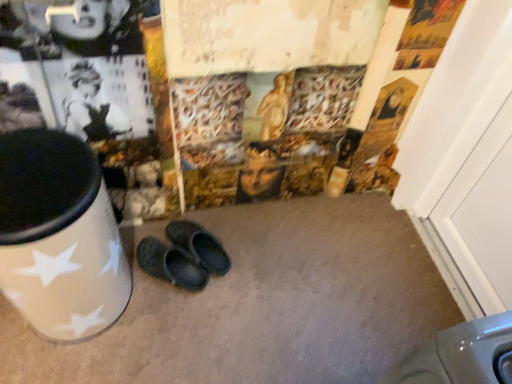
Question: Does white wood door at right have a greater width compared to black rubber clogs at center?

Choices:
 (A) yes
 (B) no

Answer: (B)

Question: Is white wood door at right facing away from black rubber clogs at center?

Choices:
 (A) yes
 (B) no

Answer: (B)

Question: Is white wood door at right completely or partially outside of black rubber clogs at center?

Choices:
 (A) no
 (B) yes

Answer: (B)

Question: From the image's perspective, is white wood door at right beneath black rubber clogs at center?

Choices:
 (A) yes
 (B) no

Answer: (B)

Question: Can you confirm if white wood door at right is shorter than black rubber clogs at center?

Choices:
 (A) yes
 (B) no

Answer: (B)

Question: Is point (458, 248) positioned closer to the camera than point (55, 251)?

Choices:
 (A) farther
 (B) closer

Answer: (A)

Question: From a real-world perspective, is white wood door at right positioned above or below white glossy waste container at left?

Choices:
 (A) below
 (B) above

Answer: (B)

Question: From the image's perspective, is white wood door at right positioned above or below white glossy waste container at left?

Choices:
 (A) above
 (B) below

Answer: (A)

Question: In the image, is white wood door at right on the left side or the right side of white glossy waste container at left?

Choices:
 (A) left
 (B) right

Answer: (B)

Question: In the image, is white glossy waste container at left positioned in front of or behind black rubber clogs at center?

Choices:
 (A) front
 (B) behind

Answer: (A)

Question: From the image's perspective, relative to black rubber clogs at center, is white glossy waste container at left above or below?

Choices:
 (A) below
 (B) above

Answer: (B)

Question: From a real-world perspective, is white glossy waste container at left positioned above or below black rubber clogs at center?

Choices:
 (A) below
 (B) above

Answer: (B)

Question: Is white glossy waste container at left situated inside black rubber clogs at center or outside?

Choices:
 (A) outside
 (B) inside

Answer: (A)

Question: From the image's perspective, is white glossy waste container at left located above or below white wood door at right?

Choices:
 (A) below
 (B) above

Answer: (A)

Question: Relative to white wood door at right, is white glossy waste container at left in front or behind?

Choices:
 (A) front
 (B) behind

Answer: (A)